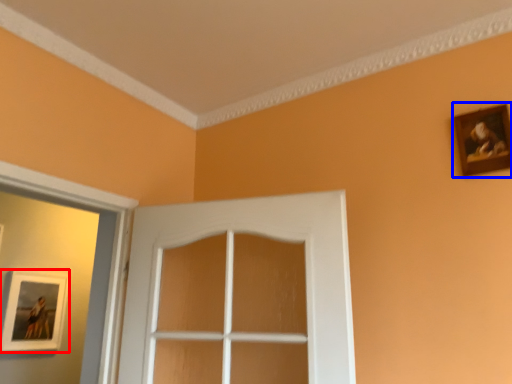
Question: Which object appears farthest to the camera in this image, picture frame (highlighted by a red box) or picture frame (highlighted by a blue box)?

Choices:
 (A) picture frame
 (B) picture frame

Answer: (A)